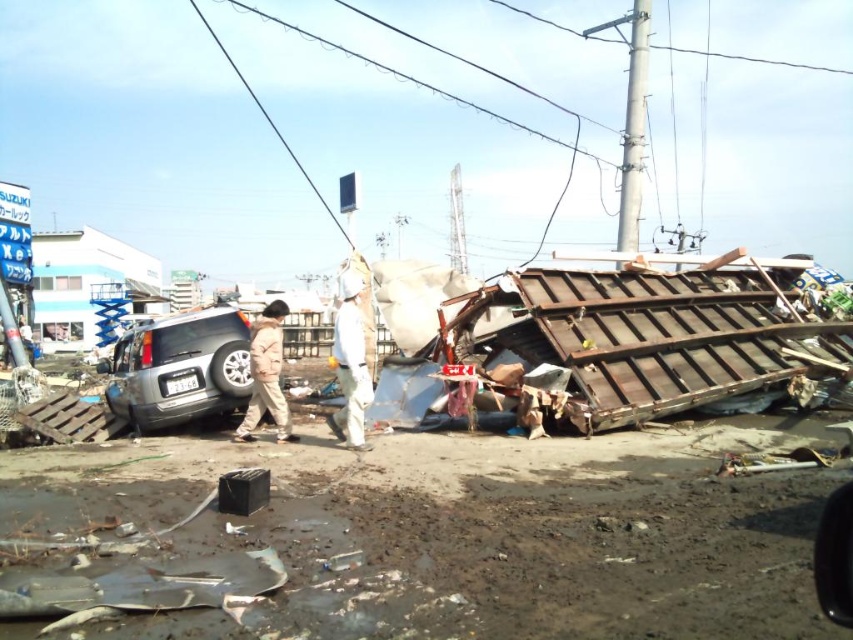
You are a rescue worker in the disaster area. You see a white fabric at center and a khaki fabric jacket at center. Which one is taller?

The white fabric at center is taller than the khaki fabric jacket at center.

You are a rescue worker trying to navigate through the disaster area. You see the silver metallic suv at center and the white fabric at center. Can you determine if the suv is wider than the white fabric?

The silver metallic suv at center might be wider than white fabric at center according to the description.